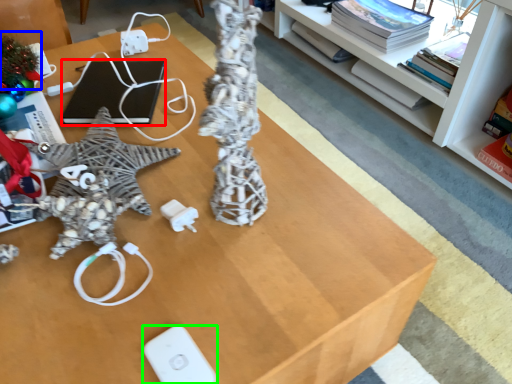
Question: Which object is the closest to the laptop (highlighted by a red box)? Choose among these: christmas decoration (highlighted by a blue box) or Wii controller (highlighted by a green box).

Choices:
 (A) christmas decoration
 (B) Wii controller

Answer: (A)